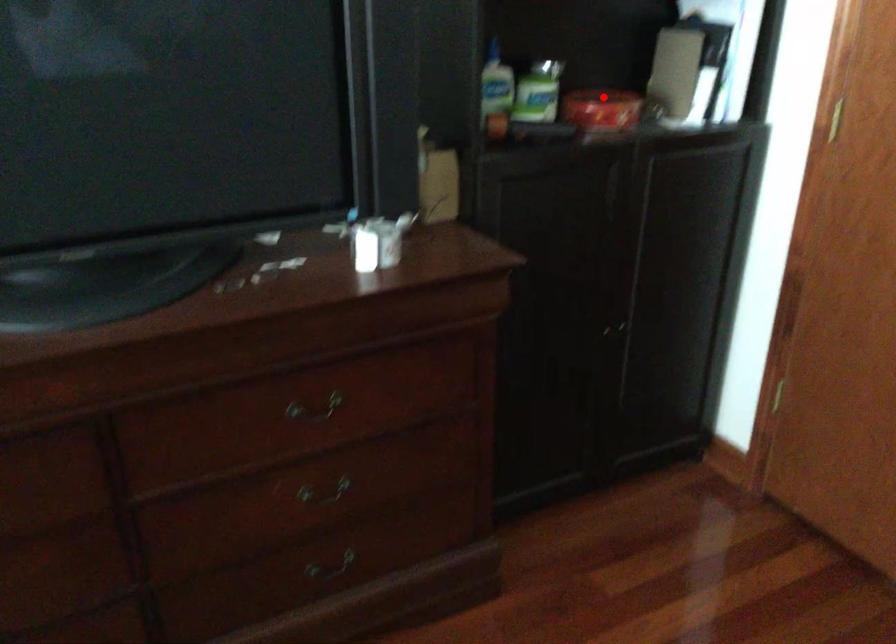
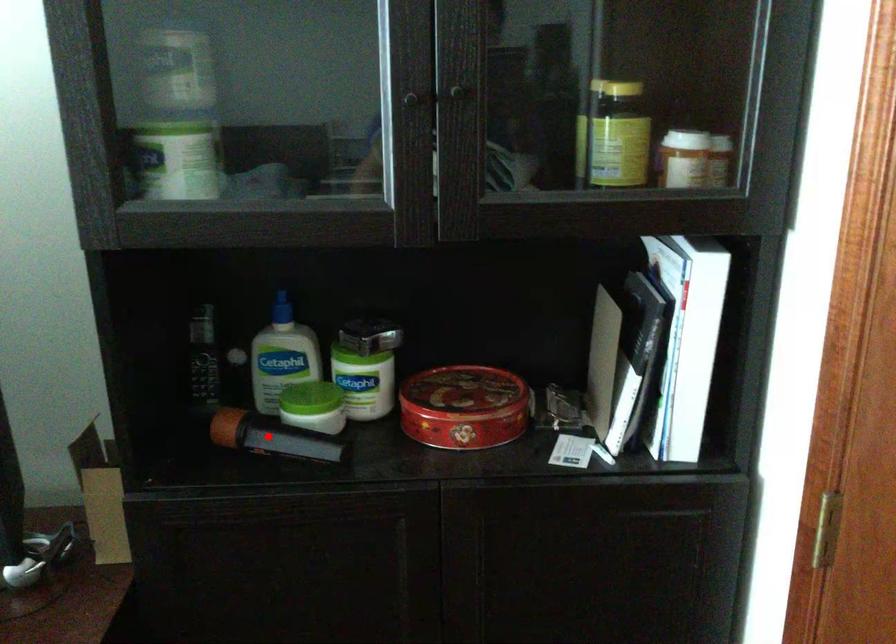
I am providing you with two images of the same scene from different viewpoints. A red point is marked on the first image and another point is marked on the second image. Is the red point in image1 aligned with the point shown in image2?

No